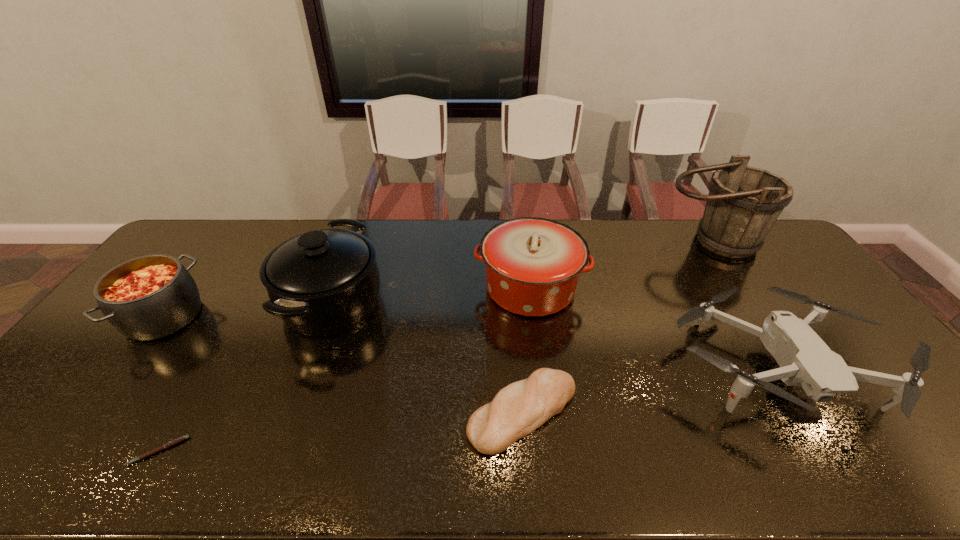
Locate an element on the screen. The image size is (960, 540). drone at the near edge is located at coordinates (805, 360).

This screenshot has width=960, height=540. I want to click on bread located at the near edge, so click(x=518, y=409).

The image size is (960, 540). What are the coordinates of `pen located in the near edge section of the desktop` in the screenshot? It's located at (180, 439).

Identify the location of object present at the left edge. The height and width of the screenshot is (540, 960). (149, 297).

Image resolution: width=960 pixels, height=540 pixels. I want to click on bucket that is at the right edge, so click(x=743, y=204).

At what (x,y) coordinates should I click in order to perform the action: click on drone that is at the right edge. Please return your answer as a coordinate pair (x, y). The image size is (960, 540). Looking at the image, I should click on (805, 360).

The width and height of the screenshot is (960, 540). What are the coordinates of `object that is positioned at the far right corner` in the screenshot? It's located at (743, 204).

At what (x,y) coordinates should I click in order to perform the action: click on object present at the near right corner. Please return your answer as a coordinate pair (x, y). Looking at the image, I should click on (805, 360).

In the image, there is a desktop. Where is `vacant region at the far edge`? This screenshot has width=960, height=540. vacant region at the far edge is located at coordinates (730, 258).

I want to click on vacant region at the near edge of the desktop, so click(516, 472).